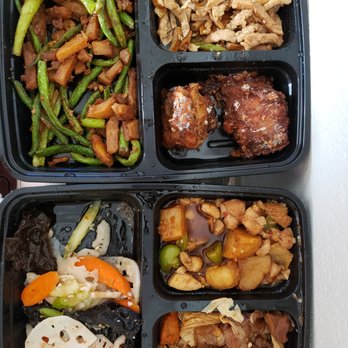
Locate an element on the screen. plastic food trays is located at coordinates (299, 66), (307, 264).